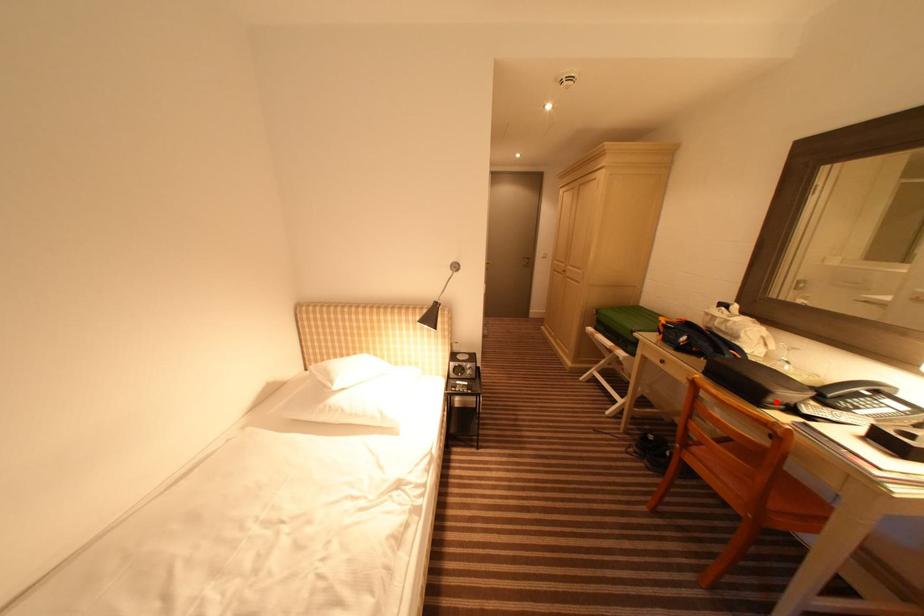
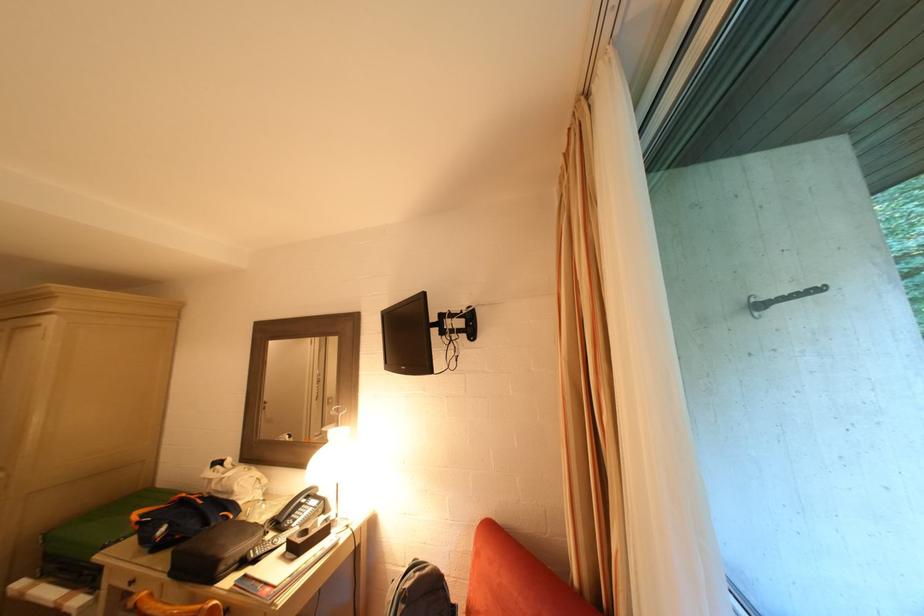
Find the pixel in the second image that matches the highlighted location in the first image.

(227, 570)